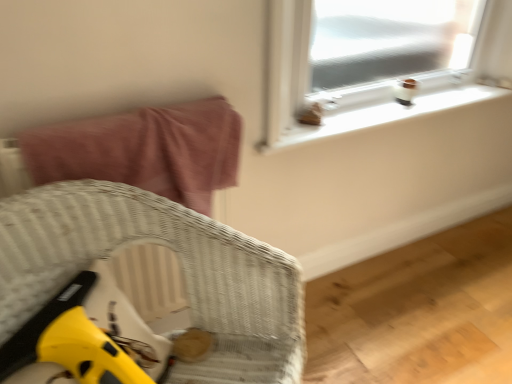
Question: Is white plastic window sill at upper right surrounded by pink fabric bed at upper left?

Choices:
 (A) yes
 (B) no

Answer: (B)

Question: Considering the relative sizes of pink fabric bed at upper left and white plastic window sill at upper right in the image provided, is pink fabric bed at upper left bigger than white plastic window sill at upper right?

Choices:
 (A) no
 (B) yes

Answer: (B)

Question: From a real-world perspective, does pink fabric bed at upper left stand above white plastic window sill at upper right?

Choices:
 (A) no
 (B) yes

Answer: (B)

Question: From the image's perspective, is pink fabric bed at upper left below white plastic window sill at upper right?

Choices:
 (A) no
 (B) yes

Answer: (B)

Question: Could you tell me if pink fabric bed at upper left is turned towards white plastic window sill at upper right?

Choices:
 (A) no
 (B) yes

Answer: (A)

Question: Is pink fabric bed at upper left wider or thinner than woven wicker chair at lower left?

Choices:
 (A) wide
 (B) thin

Answer: (B)

Question: Does point (150, 162) appear closer or farther from the camera than point (276, 288)?

Choices:
 (A) farther
 (B) closer

Answer: (A)

Question: Relative to woven wicker chair at lower left, is pink fabric bed at upper left in front or behind?

Choices:
 (A) behind
 (B) front

Answer: (A)

Question: In the image, is pink fabric bed at upper left on the left side or the right side of woven wicker chair at lower left?

Choices:
 (A) right
 (B) left

Answer: (B)

Question: Is white plastic window sill at upper right in front of or behind pink fabric bed at upper left in the image?

Choices:
 (A) front
 (B) behind

Answer: (B)

Question: Considering the positions of white plastic window sill at upper right and pink fabric bed at upper left in the image, is white plastic window sill at upper right bigger or smaller than pink fabric bed at upper left?

Choices:
 (A) big
 (B) small

Answer: (B)

Question: Looking at their shapes, would you say white plastic window sill at upper right is wider or thinner than pink fabric bed at upper left?

Choices:
 (A) thin
 (B) wide

Answer: (A)

Question: Does point (353, 127) appear closer or farther from the camera than point (224, 137)?

Choices:
 (A) closer
 (B) farther

Answer: (B)

Question: Is woven wicker chair at lower left wider or thinner than pink fabric bed at upper left?

Choices:
 (A) wide
 (B) thin

Answer: (A)

Question: Is woven wicker chair at lower left bigger or smaller than pink fabric bed at upper left?

Choices:
 (A) small
 (B) big

Answer: (B)